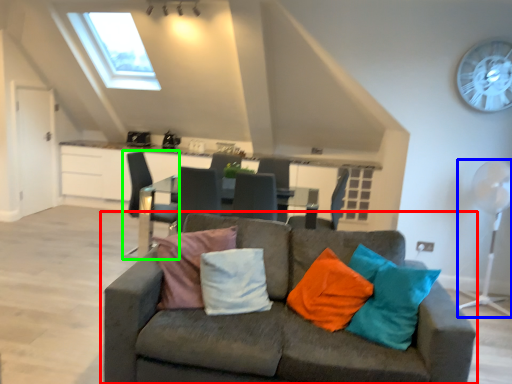
Question: Considering the real-world distances, which object is closest to studio couch (highlighted by a red box)? mechanical fan (highlighted by a blue box) or chair (highlighted by a green box).

Choices:
 (A) mechanical fan
 (B) chair

Answer: (B)